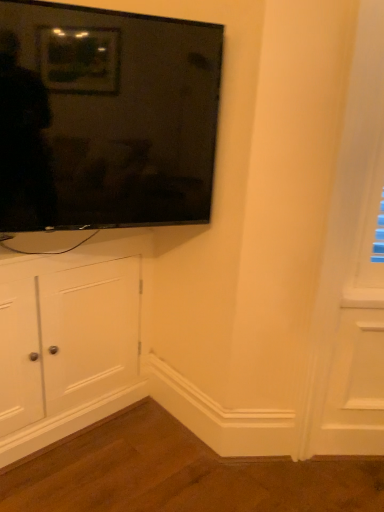
Question: Is flat screen tv at upper left taller or shorter than white wood cabinet at left?

Choices:
 (A) tall
 (B) short

Answer: (B)

Question: Is flat screen tv at upper left in front of or behind white wood cabinet at left in the image?

Choices:
 (A) behind
 (B) front

Answer: (B)

Question: Is flat screen tv at upper left to the left or to the right of white wood cabinet at left in the image?

Choices:
 (A) right
 (B) left

Answer: (A)

Question: Is point (107, 258) closer or farther from the camera than point (213, 96)?

Choices:
 (A) closer
 (B) farther

Answer: (B)

Question: From a real-world perspective, relative to flat screen tv at upper left, is white wood cabinet at left vertically above or below?

Choices:
 (A) below
 (B) above

Answer: (A)

Question: Is white wood cabinet at left taller or shorter than flat screen tv at upper left?

Choices:
 (A) tall
 (B) short

Answer: (A)

Question: Looking at their shapes, would you say white wood cabinet at left is wider or thinner than flat screen tv at upper left?

Choices:
 (A) thin
 (B) wide

Answer: (B)